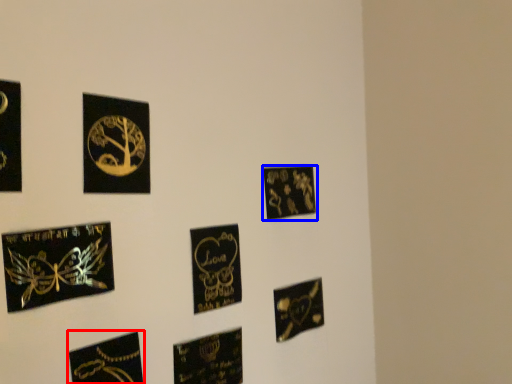
Question: Which object is further to the camera taking this photo, picture frame (highlighted by a red box) or picture frame (highlighted by a blue box)?

Choices:
 (A) picture frame
 (B) picture frame

Answer: (B)